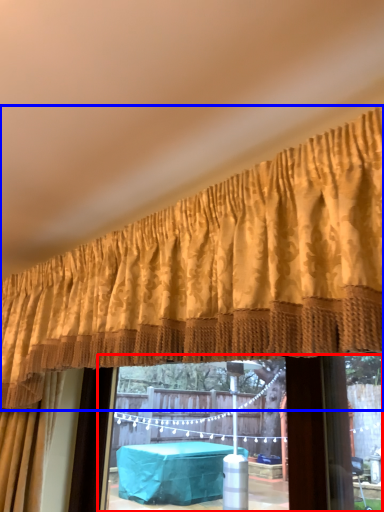
Question: Among these objects, which one is farthest to the camera, window frame (highlighted by a red box) or curtain (highlighted by a blue box)?

Choices:
 (A) window frame
 (B) curtain

Answer: (A)